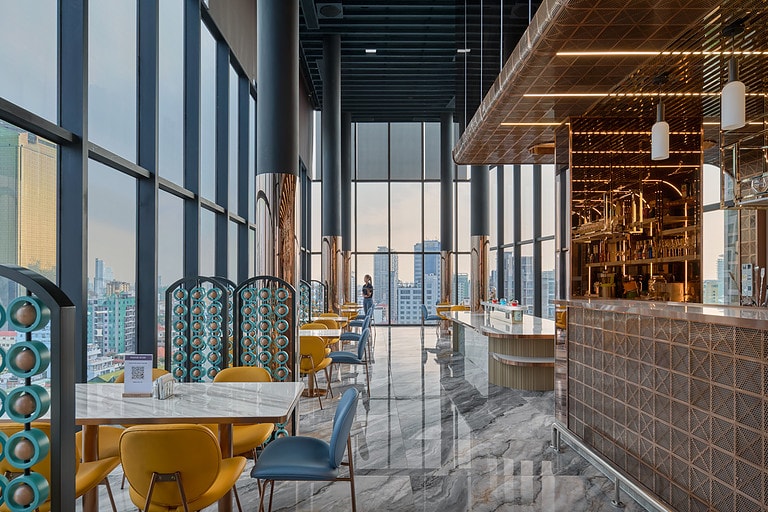
Identify the location of light fixtures. The height and width of the screenshot is (512, 768). (369, 53), (464, 51), (661, 143), (736, 110).